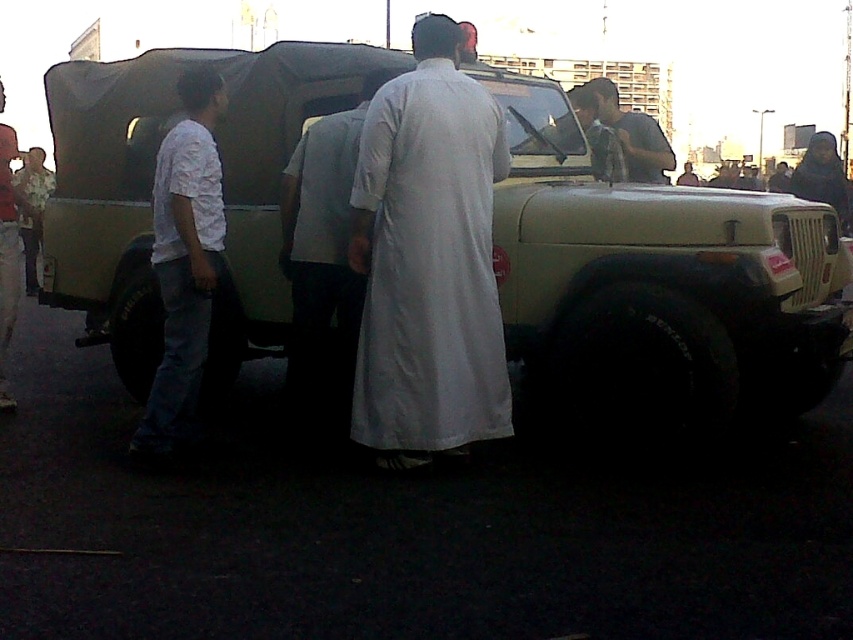
Question: Which point is farther to the camera?

Choices:
 (A) (296, 346)
 (B) (209, 248)

Answer: (A)

Question: Which point appears closest to the camera in this image?

Choices:
 (A) (169, 278)
 (B) (625, 132)
 (C) (0, 340)
 (D) (474, 420)

Answer: (A)

Question: Does white cotton robe at center have a smaller size compared to white matte robe at left?

Choices:
 (A) no
 (B) yes

Answer: (A)

Question: Can you confirm if matte khaki jeep at center is positioned above dark gray shirt at center?

Choices:
 (A) yes
 (B) no

Answer: (B)

Question: Can you confirm if white cotton robe at center is thinner than white cotton shirt at left?

Choices:
 (A) no
 (B) yes

Answer: (A)

Question: Which point is farther from the camera taking this photo?

Choices:
 (A) [157, 154]
 (B) [3, 157]
 (C) [640, 124]
 (D) [267, 83]

Answer: (C)